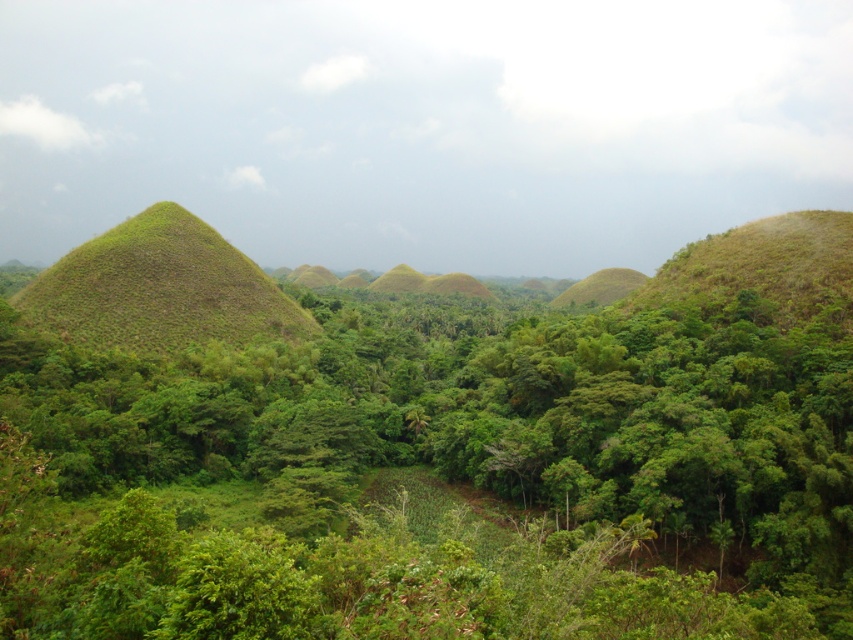
Is green leafy tree at center positioned at the back of green grassy hill at left?

No, it is not.

Locate an element on the screen. The height and width of the screenshot is (640, 853). green leafy tree at center is located at coordinates (433, 477).